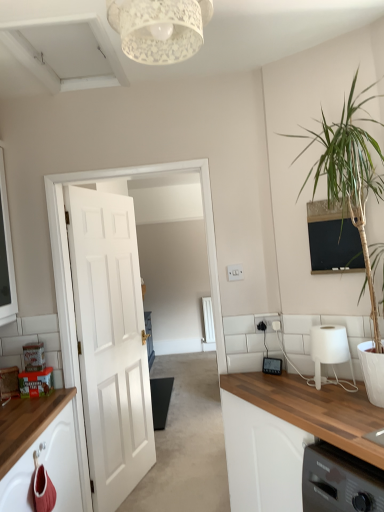
Question: From a real-world perspective, does white painted wood door at left stand above matte black thermostat at center?

Choices:
 (A) no
 (B) yes

Answer: (B)

Question: From the image's perspective, does white painted wood door at left appear higher than matte black thermostat at center?

Choices:
 (A) no
 (B) yes

Answer: (A)

Question: From the image's perspective, is white painted wood door at left under matte black thermostat at center?

Choices:
 (A) no
 (B) yes

Answer: (B)

Question: Does white painted wood door at left have a greater width compared to matte black thermostat at center?

Choices:
 (A) yes
 (B) no

Answer: (A)

Question: From a real-world perspective, is white painted wood door at left physically below matte black thermostat at center?

Choices:
 (A) no
 (B) yes

Answer: (A)

Question: Is point (134, 58) positioned closer to the camera than point (344, 336)?

Choices:
 (A) farther
 (B) closer

Answer: (B)

Question: Considering the positions of white lace lampshade at upper center and white matte lamp at right in the image, is white lace lampshade at upper center bigger or smaller than white matte lamp at right?

Choices:
 (A) small
 (B) big

Answer: (B)

Question: From the image's perspective, is white lace lampshade at upper center above or below white matte lamp at right?

Choices:
 (A) below
 (B) above

Answer: (B)

Question: Relative to white matte lamp at right, is white lace lampshade at upper center in front or behind?

Choices:
 (A) behind
 (B) front

Answer: (B)

Question: From their relative heights in the image, would you say white matte lamp at right is taller or shorter than green leafy plant at right?

Choices:
 (A) short
 (B) tall

Answer: (A)

Question: Considering their positions, is white matte lamp at right located in front of or behind green leafy plant at right?

Choices:
 (A) front
 (B) behind

Answer: (B)

Question: In terms of size, does white matte lamp at right appear bigger or smaller than green leafy plant at right?

Choices:
 (A) big
 (B) small

Answer: (B)

Question: From the image's perspective, is white matte lamp at right above or below green leafy plant at right?

Choices:
 (A) below
 (B) above

Answer: (A)

Question: From a real-world perspective, is white lace lampshade at upper center positioned above or below white glossy door at center?

Choices:
 (A) below
 (B) above

Answer: (B)

Question: Considering the positions of white lace lampshade at upper center and white glossy door at center in the image, is white lace lampshade at upper center bigger or smaller than white glossy door at center?

Choices:
 (A) small
 (B) big

Answer: (A)